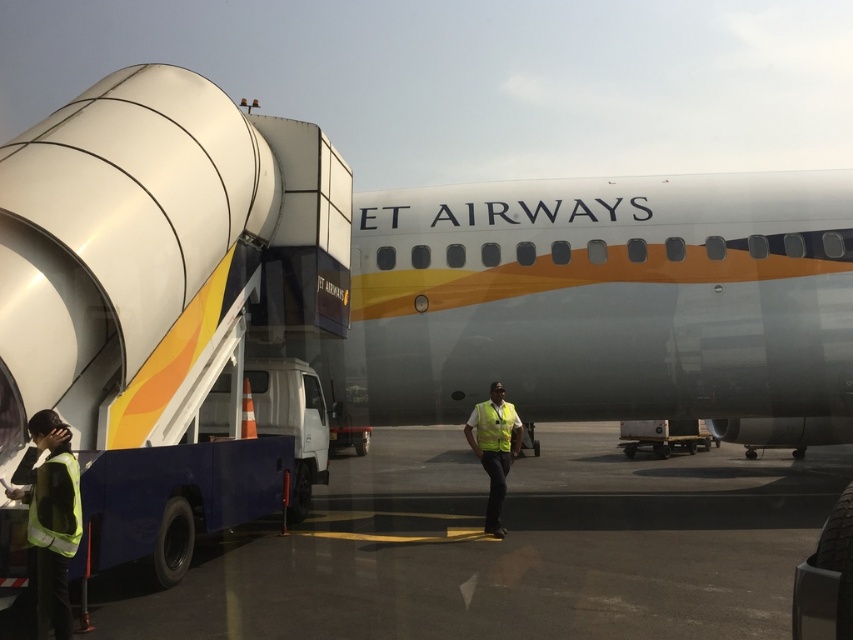
You are a pilot standing on the gray asphalt at center, looking at the silver metallic airplane at center. Which object is taller from your perspective?

The gray asphalt at center is taller than the silver metallic airplane at center.

In the scene shown: You are a maintenance worker standing at the center of the tarmac. You need to locate the yellow reflective vest at center. According to the coordinates provided, where exactly should you look to find it?

The yellow reflective vest at center is located at the coordinates point [494,449].

You are standing on the gray asphalt at center and looking towards the silver metallic airplane at center. Which object is closer to you?

The silver metallic airplane at center is closer to you than the gray asphalt at center because it is positioned further to the viewer.